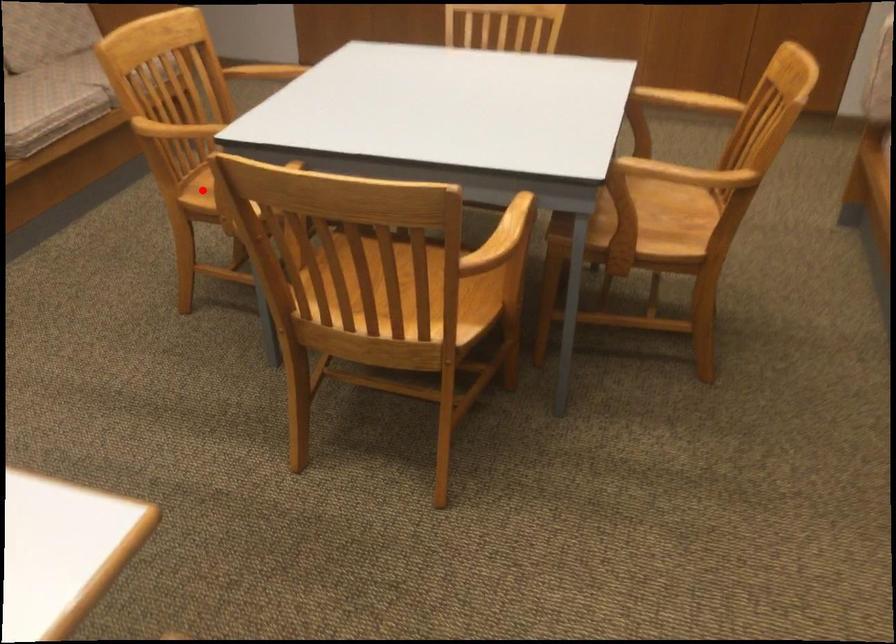
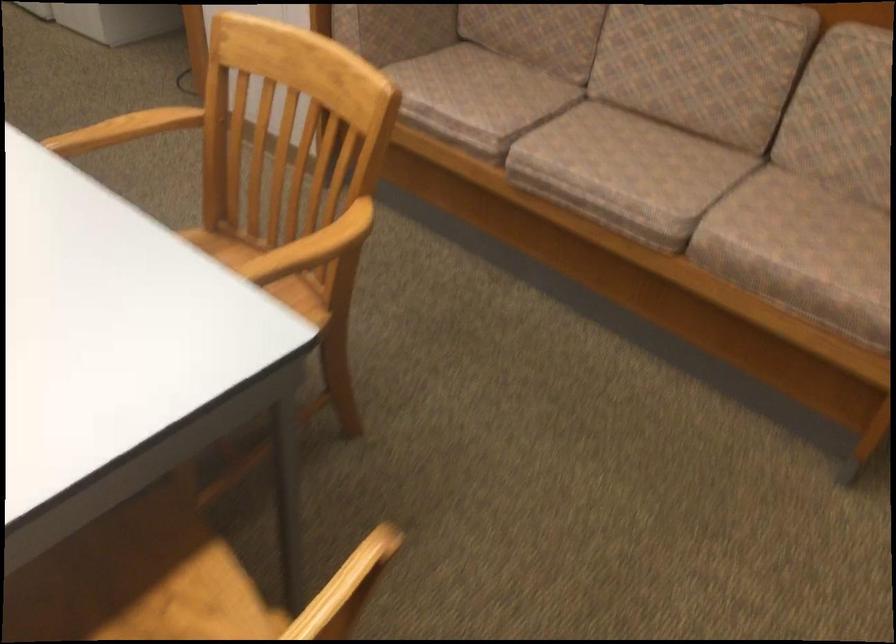
Question: A red point is marked in image1. In image2, is the corresponding 3D point closer to the camera or farther? Reply with the corresponding letter.

Choices:
 (A) The corresponding 3D point is closer.
 (B) The corresponding 3D point is farther.

Answer: (A)